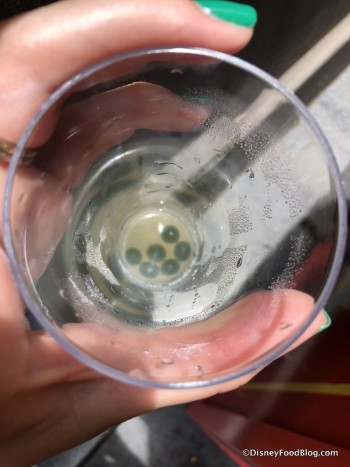
The height and width of the screenshot is (467, 350). In order to click on cup in this screenshot , I will do `click(255, 144)`.